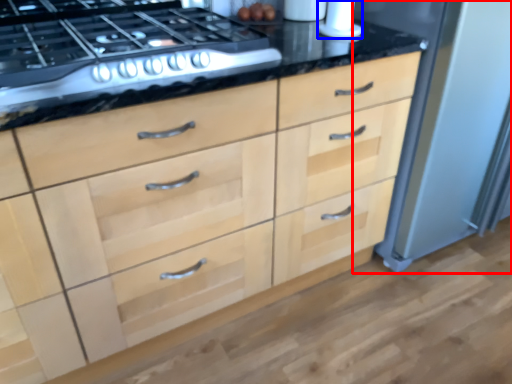
Question: Among these objects, which one is farthest to the camera, appliance (highlighted by a red box) or appliance (highlighted by a blue box)?

Choices:
 (A) appliance
 (B) appliance

Answer: (B)